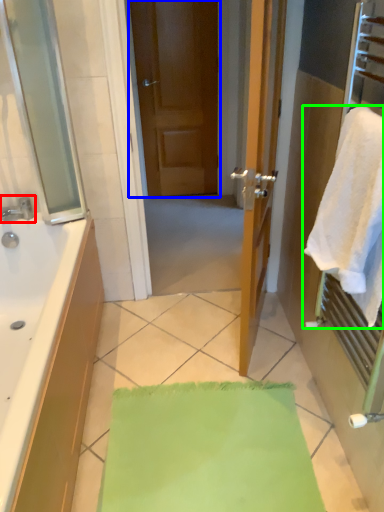
Question: Based on their relative distances, which object is nearer to tap (highlighted by a red box)? Choose from door (highlighted by a blue box) and towel (highlighted by a green box).

Choices:
 (A) door
 (B) towel

Answer: (B)